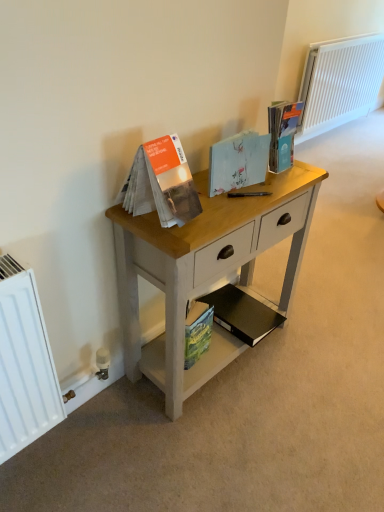
The image size is (384, 512). What do you see at coordinates (197, 332) in the screenshot? I see `green matte paperback book at lower center, which appears as the 1th paperback book when ordered from the bottom` at bounding box center [197, 332].

Where is `black matte book at lower center, which is the 2th paperback book from bottom to top`? black matte book at lower center, which is the 2th paperback book from bottom to top is located at coordinates (242, 314).

Image resolution: width=384 pixels, height=512 pixels. Identify the location of light blue paper at center, the 2th paperback book positioned from the top. (238, 162).

What is the approximate width of white painted radiator at upper right?

It is 6.32 inches.

What is the approximate width of light wood desk at center?

light wood desk at center is 12.24 inches wide.

Locate an element on the screen. The width and height of the screenshot is (384, 512). light wood desk at center is located at coordinates (205, 270).

Identify the location of matte blue paperback book at upper right, the 4th paperback book when ordered from bottom to top. Image resolution: width=384 pixels, height=512 pixels. (282, 134).

How different are the orientations of white painted radiator at upper right and light blue paper at center, the third paperback book positioned from the bottom, in degrees?

The angle between the facing direction of white painted radiator at upper right and the facing direction of light blue paper at center, the third paperback book positioned from the bottom, is 3.82 degrees.

Considering the points (361, 72) and (215, 147), which point is in front, point (361, 72) or point (215, 147)?

The point (215, 147) is closer to the camera.

From the picture: From a real-world perspective, who is located lower, white painted radiator at upper right or light blue paper at center, the 2th paperback book positioned from the top?

white painted radiator at upper right, from a real-world perspective.

Which object is wider, white painted radiator at upper right or light blue paper at center, the 2th paperback book positioned from the top?

white painted radiator at upper right.

Is point (283, 144) closer or farther from the camera than point (195, 346)?

Point (283, 144) is closer to the camera than point (195, 346).

Is green matte paperback book at lower center, which appears as the 1th paperback book when ordered from the bottom, at the back of matte blue paperback book at upper right, the 1th paperback book viewed from the top?

No, matte blue paperback book at upper right, the 1th paperback book viewed from the top, is not facing the opposite direction of green matte paperback book at lower center, which appears as the 1th paperback book when ordered from the bottom.

Is the position of matte blue paperback book at upper right, the 4th paperback book when ordered from bottom to top, less distant than that of green matte paperback book at lower center, which appears as the 1th paperback book when ordered from the bottom?

Yes, it is.

In the scene shown: Can you tell me how much matte blue paperback book at upper right, the 1th paperback book viewed from the top, and light blue paper at center, the third paperback book positioned from the bottom, differ in facing direction?

4.33 degrees separate the facing orientations of matte blue paperback book at upper right, the 1th paperback book viewed from the top, and light blue paper at center, the third paperback book positioned from the bottom.

Is matte blue paperback book at upper right, the 4th paperback book when ordered from bottom to top, at the right side of light blue paper at center, the third paperback book positioned from the bottom?

Correct, you'll find matte blue paperback book at upper right, the 4th paperback book when ordered from bottom to top, to the right of light blue paper at center, the third paperback book positioned from the bottom.

Is light blue paper at center, the 2th paperback book positioned from the top, at the back of matte blue paperback book at upper right, the 4th paperback book when ordered from bottom to top?

No, matte blue paperback book at upper right, the 4th paperback book when ordered from bottom to top,'s orientation is not away from light blue paper at center, the 2th paperback book positioned from the top.

From a real-world perspective, is matte blue paperback book at upper right, the 1th paperback book viewed from the top, on top of light blue paper at center, the third paperback book positioned from the bottom?

Correct, in the physical world, matte blue paperback book at upper right, the 1th paperback book viewed from the top, is higher than light blue paper at center, the third paperback book positioned from the bottom.

Is green matte paperback book at lower center, which appears as the 4th paperback book when viewed from the top, not inside white painted radiator at upper right?

Yes, green matte paperback book at lower center, which appears as the 4th paperback book when viewed from the top, is not within white painted radiator at upper right.

From the image's perspective, is green matte paperback book at lower center, which appears as the 1th paperback book when ordered from the bottom, positioned above or below white painted radiator at upper right?

Clearly, from the image's perspective, green matte paperback book at lower center, which appears as the 1th paperback book when ordered from the bottom, is below white painted radiator at upper right.

Which of these two, green matte paperback book at lower center, which appears as the 1th paperback book when ordered from the bottom, or white painted radiator at upper right, is wider?

Wider between the two is white painted radiator at upper right.

How many degrees apart are the facing directions of green matte paperback book at lower center, which appears as the 1th paperback book when ordered from the bottom, and white painted radiator at upper right?

There is a 7.61-degree angle between the facing directions of green matte paperback book at lower center, which appears as the 1th paperback book when ordered from the bottom, and white painted radiator at upper right.

Considering the points (293, 147) and (362, 38), which point is in front, point (293, 147) or point (362, 38)?

The point (293, 147) is closer.

Is matte blue paperback book at upper right, the 1th paperback book viewed from the top, behind white painted radiator at upper right?

No, matte blue paperback book at upper right, the 1th paperback book viewed from the top, is in front of white painted radiator at upper right.

Considering the sizes of objects matte blue paperback book at upper right, the 4th paperback book when ordered from bottom to top, and white painted radiator at upper right in the image provided, who is shorter, matte blue paperback book at upper right, the 4th paperback book when ordered from bottom to top, or white painted radiator at upper right?

matte blue paperback book at upper right, the 4th paperback book when ordered from bottom to top, is shorter.

In the scene shown: From a real-world perspective, who is located lower, matte blue paperback book at upper right, the 1th paperback book viewed from the top, or white painted radiator at upper right?

white painted radiator at upper right, from a real-world perspective.

Which object is closer to the camera taking this photo, light wood desk at center or white painted radiator at upper right?

light wood desk at center.

Is light wood desk at center not within white painted radiator at upper right?

Yes.

Between light wood desk at center and white painted radiator at upper right, which one appears on the right side from the viewer's perspective?

white painted radiator at upper right is more to the right.

Image resolution: width=384 pixels, height=512 pixels. I want to click on radiator that appears above the light wood desk at center (from a real-world perspective), so click(339, 83).

Which is nearer, (218, 305) or (247, 146)?

The point (247, 146) is more forward.

Considering the positions of objects black matte book at lower center, which is the 2th paperback book from bottom to top, and light blue paper at center, the 2th paperback book positioned from the top, in the image provided, who is in front, black matte book at lower center, which is the 2th paperback book from bottom to top, or light blue paper at center, the 2th paperback book positioned from the top,?

light blue paper at center, the 2th paperback book positioned from the top, is in front.

From a real-world perspective, is black matte book at lower center, marked as the 3th paperback book in a top-to-bottom arrangement, physically above light blue paper at center, the third paperback book positioned from the bottom?

No, from a real-world perspective, black matte book at lower center, marked as the 3th paperback book in a top-to-bottom arrangement, is not above light blue paper at center, the third paperback book positioned from the bottom.

Based on their sizes in the image, would you say black matte book at lower center, which is the 2th paperback book from bottom to top, is bigger or smaller than light blue paper at center, the 2th paperback book positioned from the top?

black matte book at lower center, which is the 2th paperback book from bottom to top, is bigger than light blue paper at center, the 2th paperback book positioned from the top.

You are a GUI agent. You are given a task and a screenshot of the screen. Output one action in this format:
    pyautogui.click(x=<x>, y=<y>)
    Task: Click on the radiator that appears on the right of light blue paper at center, the third paperback book positioned from the bottom
    Image resolution: width=384 pixels, height=512 pixels.
    Given the screenshot: What is the action you would take?
    pyautogui.click(x=339, y=83)

From the image's perspective, starting from the green matte paperback book at lower center, which appears as the 1th paperback book when ordered from the bottom, which paperback book is the 3rd one above? Please provide its 2D coordinates.

[(282, 134)]

When comparing their distances from matte blue paperback book at upper right, the 1th paperback book viewed from the top, does white painted radiator at upper right or green matte paperback book at lower center, which appears as the 4th paperback book when viewed from the top, seem closer?

The object closer to matte blue paperback book at upper right, the 1th paperback book viewed from the top, is green matte paperback book at lower center, which appears as the 4th paperback book when viewed from the top.

From the image, which object appears to be farther from black matte book at lower center, which is the 2th paperback book from bottom to top, white painted radiator at upper right or light blue paper at center, the 2th paperback book positioned from the top?

white painted radiator at upper right is positioned further to the anchor black matte book at lower center, which is the 2th paperback book from bottom to top.

Which object lies further to the anchor point matte blue paperback book at upper right, the 4th paperback book when ordered from bottom to top, black matte book at lower center, which is the 2th paperback book from bottom to top, or green matte paperback book at lower center, which appears as the 1th paperback book when ordered from the bottom?

black matte book at lower center, which is the 2th paperback book from bottom to top, is positioned further to the anchor matte blue paperback book at upper right, the 4th paperback book when ordered from bottom to top.

When comparing their distances from matte blue paperback book at upper right, the 4th paperback book when ordered from bottom to top, does light blue paper at center, the 2th paperback book positioned from the top, or light wood desk at center seem closer?

light blue paper at center, the 2th paperback book positioned from the top, lies closer to matte blue paperback book at upper right, the 4th paperback book when ordered from bottom to top, than the other object.

From the image, which object appears to be farther from white painted radiator at upper right, light blue paper at center, the third paperback book positioned from the bottom, or light wood desk at center?

The object further to white painted radiator at upper right is light blue paper at center, the third paperback book positioned from the bottom.

From the image, which object appears to be nearer to matte blue paperback book at upper right, the 4th paperback book when ordered from bottom to top, green matte paperback book at lower center, which appears as the 1th paperback book when ordered from the bottom, or white painted radiator at upper right?

green matte paperback book at lower center, which appears as the 1th paperback book when ordered from the bottom, lies closer to matte blue paperback book at upper right, the 4th paperback book when ordered from bottom to top, than the other object.

When comparing their distances from light wood desk at center, does green matte paperback book at lower center, which appears as the 4th paperback book when viewed from the top, or light blue paper at center, the third paperback book positioned from the bottom, seem further?

light blue paper at center, the third paperback book positioned from the bottom, is further to light wood desk at center.

Estimate the real-world distances between objects in this image. Which object is further from light wood desk at center, white painted radiator at upper right or green matte paperback book at lower center, which appears as the 1th paperback book when ordered from the bottom?

white painted radiator at upper right.

Locate an element on the screen. Image resolution: width=384 pixels, height=512 pixels. paperback book between matte blue paperback book at upper right, the 1th paperback book viewed from the top, and black matte book at lower center, marked as the 3th paperback book in a top-to-bottom arrangement, vertically is located at coordinates (238, 162).

Find the location of a particular element. This screenshot has height=512, width=384. paperback book between light blue paper at center, the 2th paperback book positioned from the top, and green matte paperback book at lower center, which appears as the 1th paperback book when ordered from the bottom, vertically is located at coordinates [x=242, y=314].

Locate an element on the screen. The image size is (384, 512). paperback book between matte blue paperback book at upper right, the 4th paperback book when ordered from bottom to top, and light wood desk at center vertically is located at coordinates (x=238, y=162).

At what (x,y) coordinates should I click in order to perform the action: click on desk that lies between light blue paper at center, the third paperback book positioned from the bottom, and green matte paperback book at lower center, which appears as the 4th paperback book when viewed from the top, from top to bottom. Please return your answer as a coordinate pair (x, y). The width and height of the screenshot is (384, 512). Looking at the image, I should click on (205, 270).